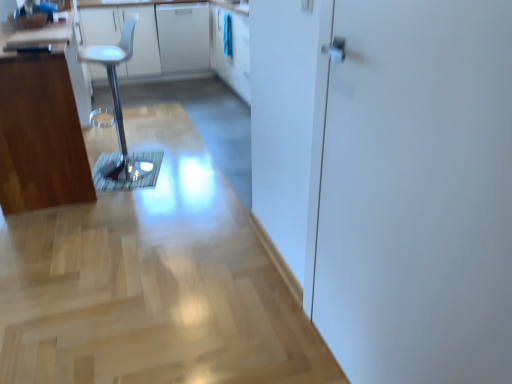
Question: Is white glossy door at right spatially inside white glossy counter top at upper left, or outside of it?

Choices:
 (A) inside
 (B) outside

Answer: (B)

Question: Considering the positions of white glossy door at right and white glossy counter top at upper left in the image, is white glossy door at right taller or shorter than white glossy counter top at upper left?

Choices:
 (A) short
 (B) tall

Answer: (B)

Question: Estimate the real-world distances between objects in this image. Which object is farther from the white glossy door at right?

Choices:
 (A) white glossy counter top at upper left
 (B) white glossy cabinet at upper center, the 1th cabinetry from the back
 (C) white plastic stool at left
 (D) wooden cabinet at left, the second cabinetry when ordered from back to front

Answer: (B)

Question: Based on their relative distances, which object is farther from the white plastic stool at left?

Choices:
 (A) white glossy door at right
 (B) wooden cabinet at left, which is the 2th cabinetry in top-to-bottom order
 (C) white glossy counter top at upper left
 (D) white glossy cabinet at upper center, the first cabinetry viewed from the top

Answer: (A)